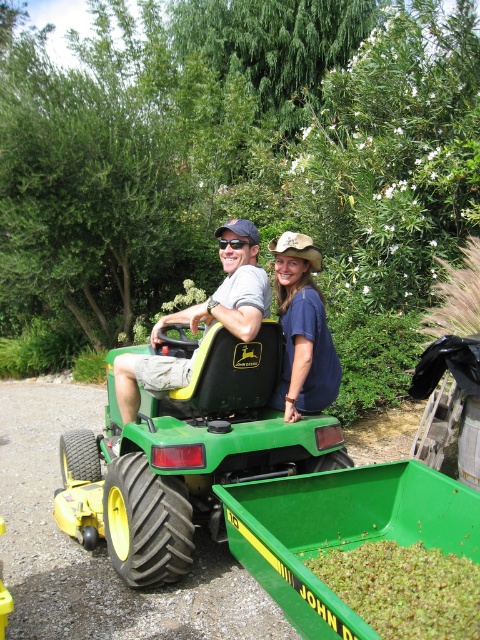
Which of these two, green rubber lawn mower at center or blue cotton shirt at center, stands taller?

With more height is green rubber lawn mower at center.

Is green rubber lawn mower at center smaller than blue cotton shirt at center?

Incorrect, green rubber lawn mower at center is not smaller in size than blue cotton shirt at center.

Between point (250, 365) and point (320, 356), which one is positioned in front?

Point (250, 365) is more forward.

This screenshot has height=640, width=480. Identify the location of green rubber lawn mower at center. (187, 458).

Is point (249, 339) less distant than point (303, 241)?

That is True.

Who is positioned more to the right, matte black tractor at center or blue cotton shirt at center?

From the viewer's perspective, blue cotton shirt at center appears more on the right side.

Between point (254, 305) and point (307, 400), which one is positioned behind?

The point (307, 400) is behind.

This screenshot has height=640, width=480. I want to click on matte black tractor at center, so click(230, 288).

Who is taller, green rubber lawn mower at center or matte black tractor at center?

green rubber lawn mower at center is taller.

Is green rubber lawn mower at center positioned in front of matte black tractor at center?

Yes.

What do you see at coordinates (187, 458) in the screenshot? This screenshot has width=480, height=640. I see `green rubber lawn mower at center` at bounding box center [187, 458].

You are a GUI agent. You are given a task and a screenshot of the screen. Output one action in this format:
    pyautogui.click(x=<x>, y=<y>)
    Task: Click on the green rubber lawn mower at center
    The image size is (480, 640).
    Given the screenshot: What is the action you would take?
    pyautogui.click(x=187, y=458)